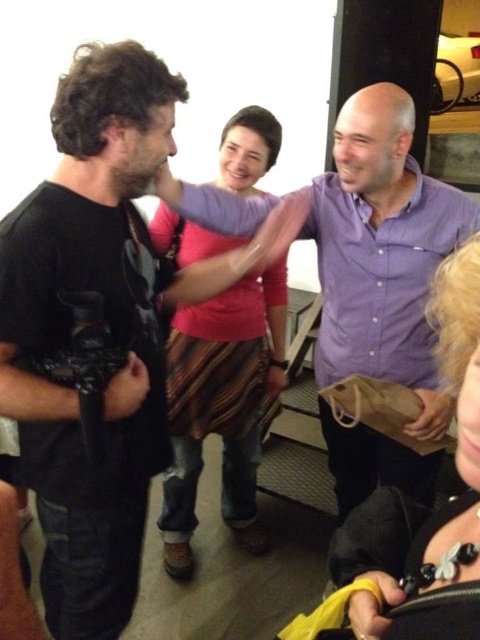
You are an actor standing at the point marked by the first coordinate, point [121,193], and you need to move to the point marked by the second coordinate, point [445,316]. Which direction should you face to walk towards the second point?

To move from point [121,193] to point [445,316], you should face towards the upper right direction since the second point is located at a higher coordinate in both the x and y axes compared to the first point.

What is the exact coordinate of the black matte camera at left in the image?

The black matte camera at left is located at coordinate point [99,330].